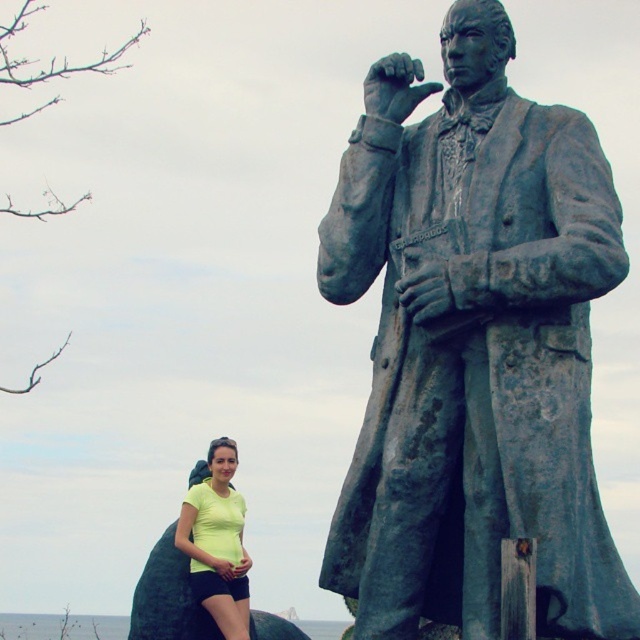
Question: Can you confirm if bronze statue at right is wider than yellow matte shirt at lower left?

Choices:
 (A) yes
 (B) no

Answer: (A)

Question: Which point is closer to the camera?

Choices:
 (A) yellow matte shirt at lower left
 (B) bronze statue at right

Answer: (B)

Question: Does bronze statue at right have a greater width compared to yellow matte shirt at lower left?

Choices:
 (A) yes
 (B) no

Answer: (A)

Question: Can you confirm if bronze statue at right is wider than yellow matte shirt at lower left?

Choices:
 (A) yes
 (B) no

Answer: (A)

Question: Which of the following is the closest to the observer?

Choices:
 (A) bronze statue at right
 (B) yellow matte shirt at lower left

Answer: (A)

Question: Among these objects, which one is farthest from the camera?

Choices:
 (A) yellow matte shirt at lower left
 (B) bronze statue at right

Answer: (A)